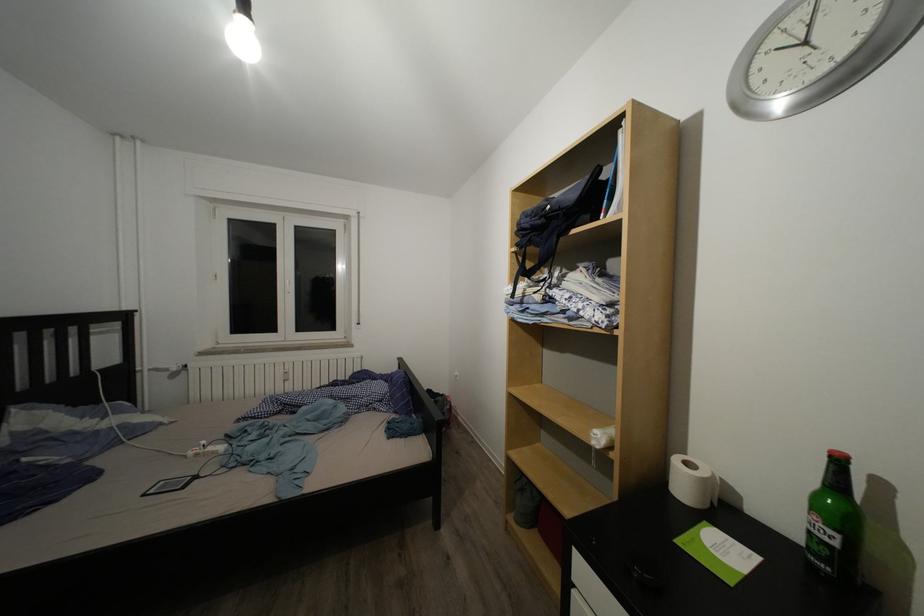
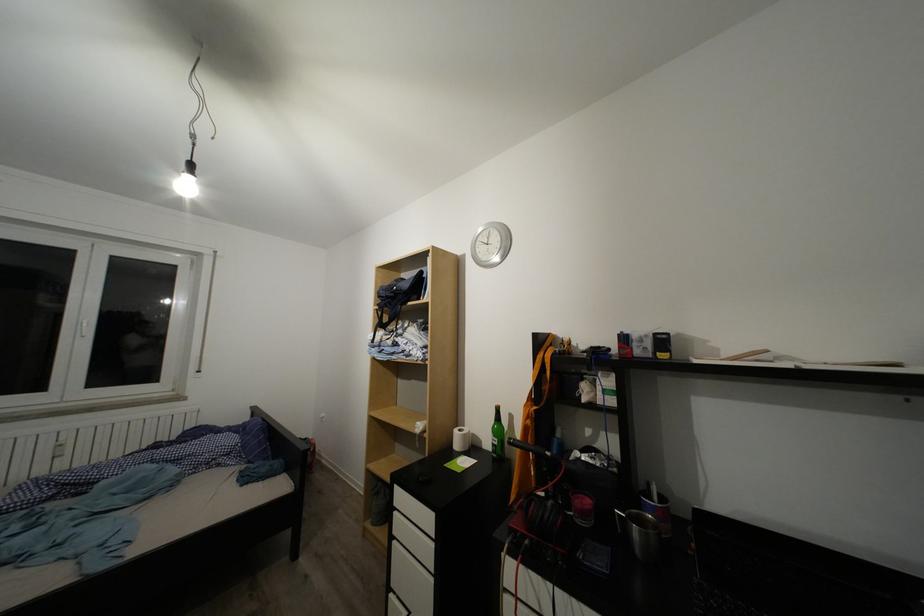
Question: I am providing you with two images of the same scene from different viewpoints. After the viewpoint changes to image2, which objects are now occluded?

Choices:
 (A) hanging lightbulb
 (B) green glass bottle
 (C) metal cup
 (D) none of these

Answer: (D)